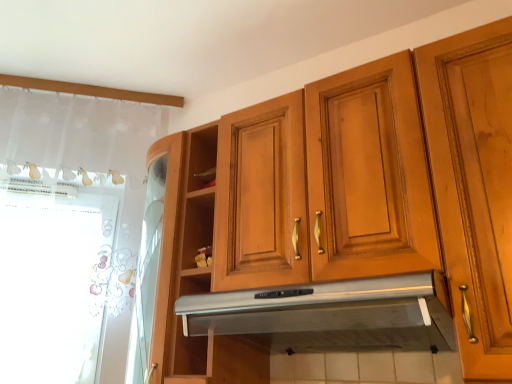
Question: Can you confirm if silver metallic exhaust hood at center is smaller than white lace curtain at left?

Choices:
 (A) no
 (B) yes

Answer: (A)

Question: Is silver metallic exhaust hood at center oriented away from white lace curtain at left?

Choices:
 (A) no
 (B) yes

Answer: (A)

Question: Does silver metallic exhaust hood at center come behind white lace curtain at left?

Choices:
 (A) yes
 (B) no

Answer: (B)

Question: Is silver metallic exhaust hood at center facing towards white lace curtain at left?

Choices:
 (A) no
 (B) yes

Answer: (A)

Question: Can you confirm if silver metallic exhaust hood at center is bigger than white lace curtain at left?

Choices:
 (A) yes
 (B) no

Answer: (A)

Question: Considering their positions, is white lace curtain at left located in front of or behind wooden cabinet at upper center?

Choices:
 (A) behind
 (B) front

Answer: (A)

Question: Considering the positions of white lace curtain at left and wooden cabinet at upper center in the image, is white lace curtain at left taller or shorter than wooden cabinet at upper center?

Choices:
 (A) tall
 (B) short

Answer: (A)

Question: Is white lace curtain at left inside or outside of wooden cabinet at upper center?

Choices:
 (A) inside
 (B) outside

Answer: (B)

Question: Considering the positions of white lace curtain at left and wooden cabinet at upper center in the image, is white lace curtain at left bigger or smaller than wooden cabinet at upper center?

Choices:
 (A) big
 (B) small

Answer: (B)

Question: Considering the positions of silver metallic exhaust hood at center and white lace curtain at left in the image, is silver metallic exhaust hood at center taller or shorter than white lace curtain at left?

Choices:
 (A) tall
 (B) short

Answer: (B)

Question: Based on their positions, is silver metallic exhaust hood at center located to the left or right of white lace curtain at left?

Choices:
 (A) right
 (B) left

Answer: (A)

Question: In terms of size, does silver metallic exhaust hood at center appear bigger or smaller than white lace curtain at left?

Choices:
 (A) small
 (B) big

Answer: (B)

Question: From a real-world perspective, is silver metallic exhaust hood at center above or below white lace curtain at left?

Choices:
 (A) below
 (B) above

Answer: (A)

Question: From a real-world perspective, is wooden cabinet at upper center above or below white lace curtain at left?

Choices:
 (A) above
 (B) below

Answer: (A)

Question: Considering the positions of wooden cabinet at upper center and white lace curtain at left in the image, is wooden cabinet at upper center bigger or smaller than white lace curtain at left?

Choices:
 (A) big
 (B) small

Answer: (A)